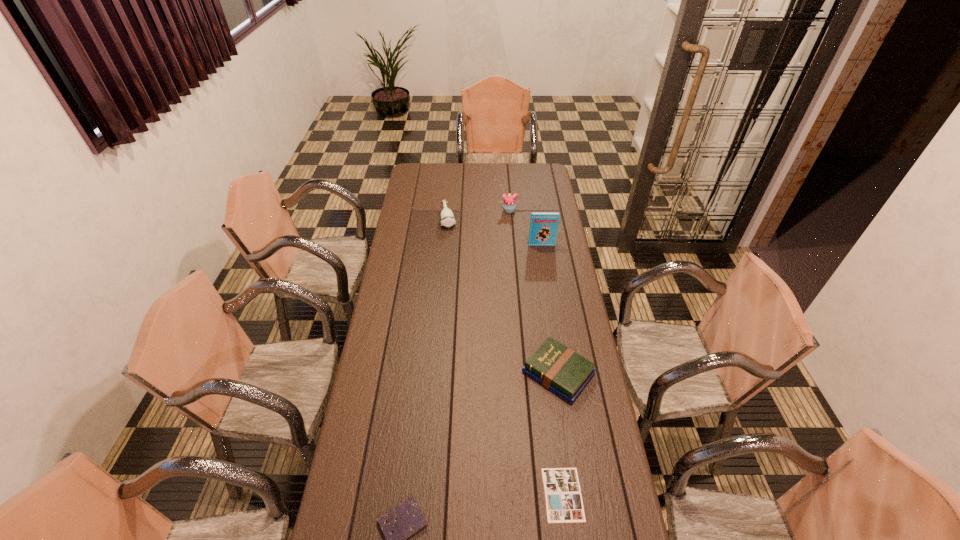
Where is `vacant space that's between the tallest object and the bottle`? The width and height of the screenshot is (960, 540). vacant space that's between the tallest object and the bottle is located at coordinates point(495,231).

Find the location of a particular element. object identified as the fourth closest to the shortest object is located at coordinates (447, 218).

Identify the location of object that is the closest one to the second shortest object. The image size is (960, 540). (563, 498).

Identify the location of the second closest book relative to the fifth tallest object. The height and width of the screenshot is (540, 960). (558, 368).

What are the coordinates of `book identified as the closest to the cupcake` in the screenshot? It's located at click(x=543, y=225).

Image resolution: width=960 pixels, height=540 pixels. Find the location of `free region that satisfies the following two spatial constraints: 1. on the front side of the fourth shortest object; 2. on the left side of the second nearest book`. free region that satisfies the following two spatial constraints: 1. on the front side of the fourth shortest object; 2. on the left side of the second nearest book is located at coordinates (436, 373).

At what (x,y) coordinates should I click in order to perform the action: click on vacant area in the image that satisfies the following two spatial constraints: 1. on the face of the fifth shortest object; 2. on the right side of the second nearest book. Please return your answer as a coordinate pair (x, y). Looking at the image, I should click on (522, 373).

This screenshot has width=960, height=540. I want to click on vacant space that satisfies the following two spatial constraints: 1. on the face of the cupcake; 2. on the left side of the nearest book, so pyautogui.click(x=532, y=494).

This screenshot has height=540, width=960. Find the location of `blank space that satisfies the following two spatial constraints: 1. on the face of the nearest book; 2. on the left side of the second tallest object`. blank space that satisfies the following two spatial constraints: 1. on the face of the nearest book; 2. on the left side of the second tallest object is located at coordinates (532, 494).

Identify the location of free space that satisfies the following two spatial constraints: 1. on the face of the shortest object; 2. on the left side of the second tallest object. This screenshot has height=540, width=960. (532, 494).